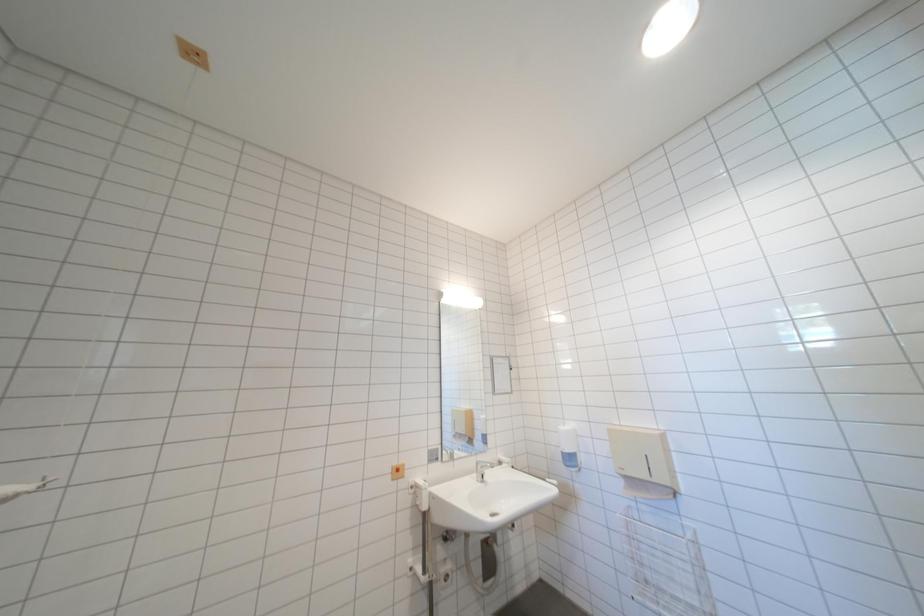
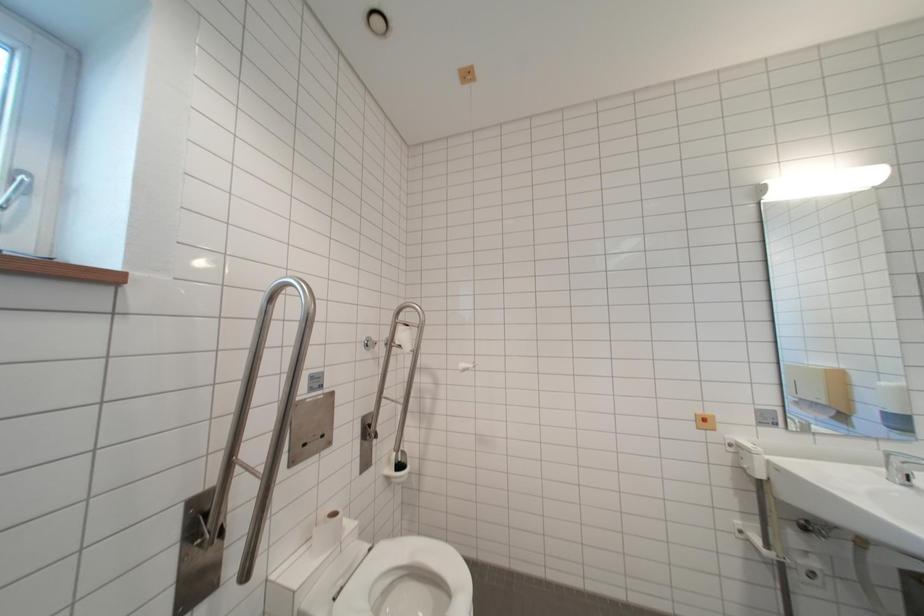
Question: How did the camera likely rotate?

Choices:
 (A) Left
 (B) Right
 (C) Up
 (D) Down

Answer: (A)